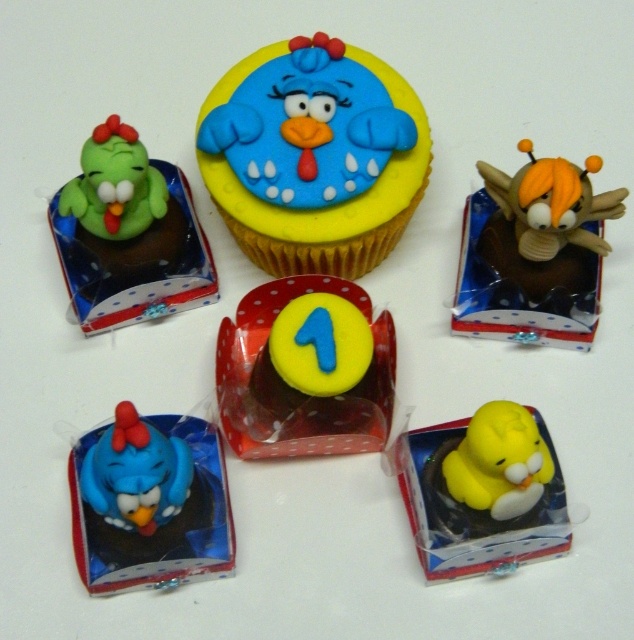
Question: Among these points, which one is farthest from the camera?

Choices:
 (A) (230, 419)
 (B) (117, 410)
 (C) (476, 435)

Answer: (A)

Question: Does yellow fondant cupcake at center have a smaller size compared to green matte bird at upper left?

Choices:
 (A) no
 (B) yes

Answer: (A)

Question: Among these objects, which one is farthest from the camera?

Choices:
 (A) matte blue rubber chicken at center
 (B) orange fuzzy bee at upper right

Answer: (B)

Question: Is yellow rubber duck at center wider than orange fuzzy bee at upper right?

Choices:
 (A) yes
 (B) no

Answer: (A)

Question: Based on their relative distances, which object is nearer to the blue fondant cupcake at center?

Choices:
 (A) matte blue rubber chicken at center
 (B) yellow rubber duck at lower right
 (C) orange fuzzy bee at upper right
 (D) green matte bird at upper left

Answer: (D)

Question: Where is yellow rubber duck at center located in relation to yellow rubber duck at lower right in the image?

Choices:
 (A) right
 (B) left

Answer: (B)